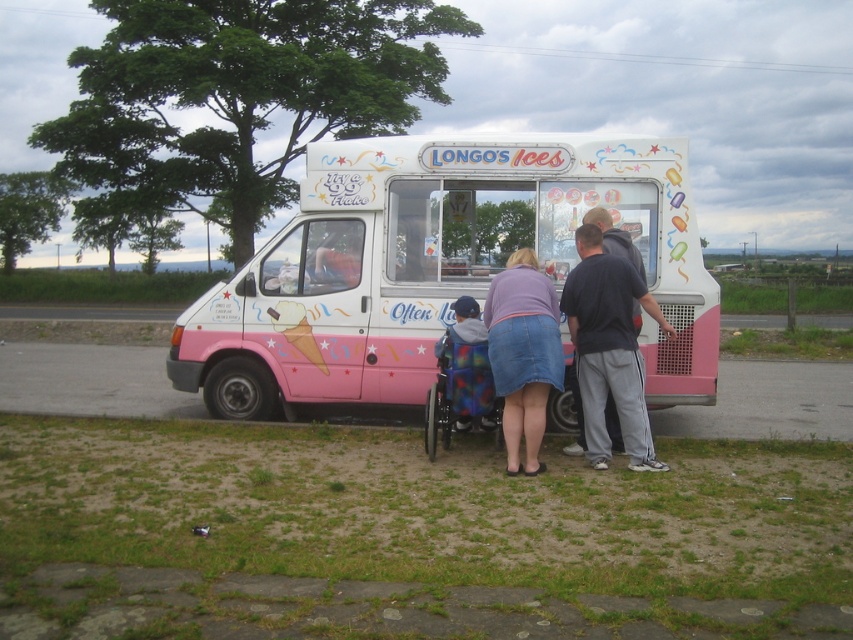
Does pink matte ice cream truck at center have a greater height compared to rainbow fabric wheelchair at center?

Incorrect, pink matte ice cream truck at center's height is not larger of rainbow fabric wheelchair at center's.

Where is `pink matte ice cream truck at center`? This screenshot has width=853, height=640. pink matte ice cream truck at center is located at coordinates (437, 268).

This screenshot has height=640, width=853. What do you see at coordinates (437, 268) in the screenshot?
I see `pink matte ice cream truck at center` at bounding box center [437, 268].

The height and width of the screenshot is (640, 853). What are the coordinates of `pink matte ice cream truck at center` in the screenshot? It's located at (437, 268).

Can you confirm if purple denim skirt at lower center is positioned below dark gray sweatpants at center?

Correct, purple denim skirt at lower center is located below dark gray sweatpants at center.

The height and width of the screenshot is (640, 853). I want to click on purple denim skirt at lower center, so click(523, 353).

Does point (428, 211) lie behind point (537, 449)?

Yes, point (428, 211) is farther from viewer.

Is the position of pink matte ice cream truck at center more distant than that of purple denim skirt at lower center?

Yes.

Who is more distant from viewer, (360, 273) or (518, 253)?

The point (360, 273) is more distant.

Image resolution: width=853 pixels, height=640 pixels. In order to click on pink matte ice cream truck at center in this screenshot , I will do `click(437, 268)`.